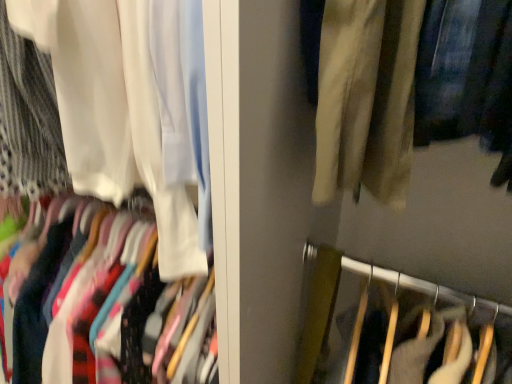
Describe the element at coordinates (112, 111) in the screenshot. The height and width of the screenshot is (384, 512). I see `white sheer curtain at upper left` at that location.

At what (x,y) coordinates should I click in order to perform the action: click on white sheer curtain at upper left. Please return your answer as a coordinate pair (x, y). This screenshot has height=384, width=512. Looking at the image, I should click on (112, 111).

The width and height of the screenshot is (512, 384). What do you see at coordinates (368, 285) in the screenshot?
I see `velvet fabric pants at center` at bounding box center [368, 285].

Measure the distance between velvet fabric pants at center and camera.

velvet fabric pants at center is 79.73 centimeters away from camera.

This screenshot has width=512, height=384. Identify the location of velvet fabric pants at center. (368, 285).

Image resolution: width=512 pixels, height=384 pixels. I want to click on white sheer curtain at upper left, so click(112, 111).

Considering the relative positions of white sheer curtain at upper left and velvet fabric pants at center in the image provided, is white sheer curtain at upper left to the right of velvet fabric pants at center from the viewer's perspective?

Incorrect, white sheer curtain at upper left is not on the right side of velvet fabric pants at center.

In the image, is white sheer curtain at upper left positioned in front of or behind velvet fabric pants at center?

white sheer curtain at upper left is in front of velvet fabric pants at center.

Considering the points (176, 255) and (328, 268), which point is behind, point (176, 255) or point (328, 268)?

The point (328, 268) is farther.

From the image's perspective, would you say white sheer curtain at upper left is positioned over velvet fabric pants at center?

Yes.

From a real-world perspective, does white sheer curtain at upper left stand above velvet fabric pants at center?

Yes, from a real-world perspective, white sheer curtain at upper left is above velvet fabric pants at center.

Can you confirm if white sheer curtain at upper left is thinner than velvet fabric pants at center?

Correct, the width of white sheer curtain at upper left is less than that of velvet fabric pants at center.

Considering the sizes of objects white sheer curtain at upper left and velvet fabric pants at center in the image provided, who is shorter, white sheer curtain at upper left or velvet fabric pants at center?

white sheer curtain at upper left is shorter.

Is white sheer curtain at upper left bigger or smaller than velvet fabric pants at center?

white sheer curtain at upper left is bigger than velvet fabric pants at center.

Would you say white sheer curtain at upper left is inside or outside velvet fabric pants at center?

white sheer curtain at upper left is located beyond the bounds of velvet fabric pants at center.

Would you say white sheer curtain at upper left is a long distance from velvet fabric pants at center?

No, there isn't a large distance between white sheer curtain at upper left and velvet fabric pants at center.

Is white sheer curtain at upper left turned away from velvet fabric pants at center?

No, velvet fabric pants at center is not at the back of white sheer curtain at upper left.

In the scene shown: Can you tell me how much white sheer curtain at upper left and velvet fabric pants at center differ in facing direction?

They differ by 0.485 degrees in their facing directions.

In order to click on closet behind the white sheer curtain at upper left in this screenshot , I will do `click(368, 285)`.

Can you confirm if velvet fabric pants at center is positioned to the left of white sheer curtain at upper left?

Incorrect, velvet fabric pants at center is not on the left side of white sheer curtain at upper left.

Which object is further away from the camera taking this photo, velvet fabric pants at center or white sheer curtain at upper left?

velvet fabric pants at center is further from the camera.

Is point (307, 370) closer or farther from the camera than point (124, 82)?

Clearly, point (307, 370) is more distant from the camera than point (124, 82).

From the image's perspective, which one is positioned lower, velvet fabric pants at center or white sheer curtain at upper left?

velvet fabric pants at center appears lower in the image.

From a real-world perspective, is velvet fabric pants at center located higher than white sheer curtain at upper left?

No, from a real-world perspective, velvet fabric pants at center is not on top of white sheer curtain at upper left.

Between velvet fabric pants at center and white sheer curtain at upper left, which one has larger width?

velvet fabric pants at center.

Can you confirm if velvet fabric pants at center is shorter than white sheer curtain at upper left?

No.

Can you confirm if velvet fabric pants at center is bigger than white sheer curtain at upper left?

Actually, velvet fabric pants at center might be smaller than white sheer curtain at upper left.

Do you think velvet fabric pants at center is within white sheer curtain at upper left, or outside of it?

velvet fabric pants at center lies outside white sheer curtain at upper left.

Is there a large distance between velvet fabric pants at center and white sheer curtain at upper left?

No, velvet fabric pants at center is not far from white sheer curtain at upper left.

Consider the image. Could you tell me if velvet fabric pants at center is turned towards white sheer curtain at upper left?

No, velvet fabric pants at center does not turn towards white sheer curtain at upper left.

Can you tell me how much velvet fabric pants at center and white sheer curtain at upper left differ in facing direction?

They differ by 0.485 degrees in their facing directions.

At what (x,y) coordinates should I click in order to perform the action: click on curtain above the velvet fabric pants at center (from a real-world perspective). Please return your answer as a coordinate pair (x, y). Looking at the image, I should click on (112, 111).

The image size is (512, 384). Identify the location of closet behind the white sheer curtain at upper left. (368, 285).

Identify the location of closet below the white sheer curtain at upper left (from the image's perspective). This screenshot has width=512, height=384. (368, 285).